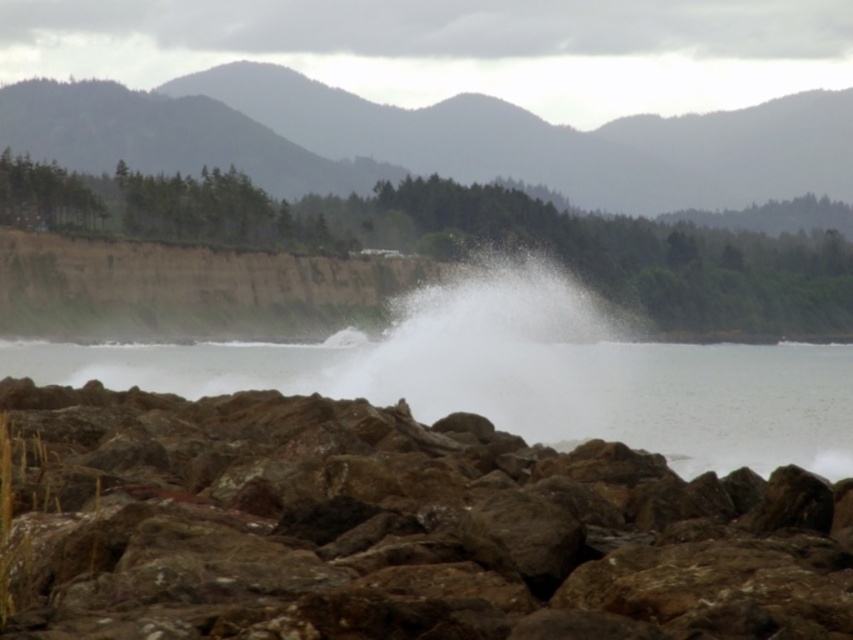
Question: Which object is farther from the camera taking this photo?

Choices:
 (A) brown rough rocks at lower center
 (B) white frothy water at center

Answer: (B)

Question: Can you confirm if brown rough rocks at lower center is positioned to the left of white frothy water at center?

Choices:
 (A) yes
 (B) no

Answer: (A)

Question: Where is brown rough rocks at lower center located in relation to white frothy water at center in the image?

Choices:
 (A) below
 (B) above

Answer: (A)

Question: Is brown rough rocks at lower center further to the viewer compared to white frothy water at center?

Choices:
 (A) yes
 (B) no

Answer: (B)